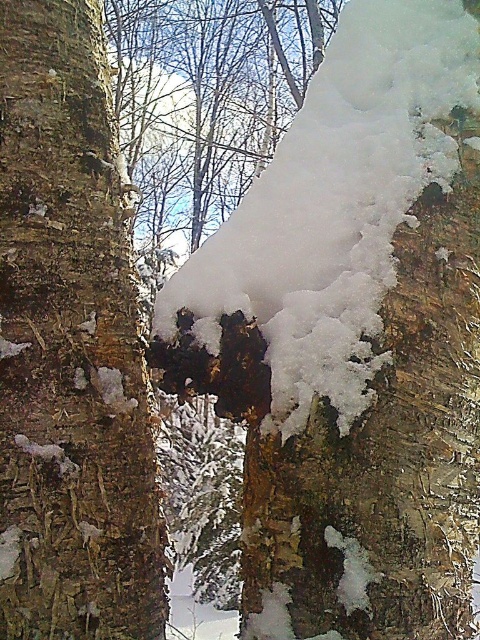
You are a hiker trying to identify landmarks in a snowy forest. You see the brown textured bark at center and the white fluffy snow at center. Which one is smaller in size?

The brown textured bark at center is smaller than the white fluffy snow at center.

You are an animal trying to find a path through the snowy forest. You notice the brown textured bark at center and the white fluffy snow at center. Which one is located to the left of the other?

The brown textured bark at center is positioned on the left side of white fluffy snow at center.

You are standing in the snowy forest and see two points marked on the tree trunks. Which point, point (66,317) or point (317,220), is closer to you?

Point (66,317) is closer to the viewer than point (317,220).